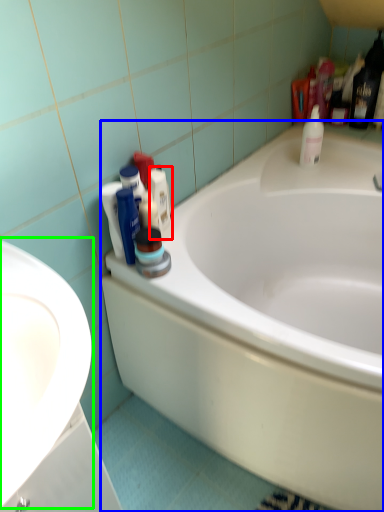
Question: Which object is the farthest from toiletry (highlighted by a red box)? Choose among these: bathtub (highlighted by a blue box) or sink (highlighted by a green box).

Choices:
 (A) bathtub
 (B) sink

Answer: (B)